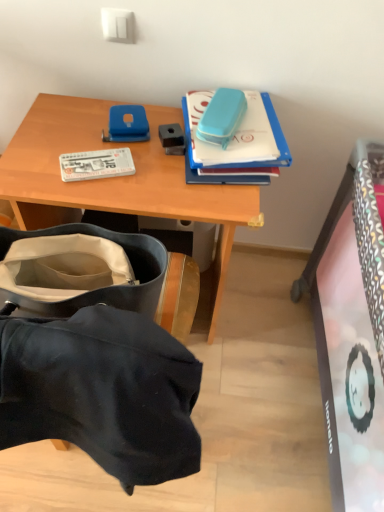
What are the coordinates of `vacant area that lies to the right of wooden desk at upper center` in the screenshot? It's located at (267, 328).